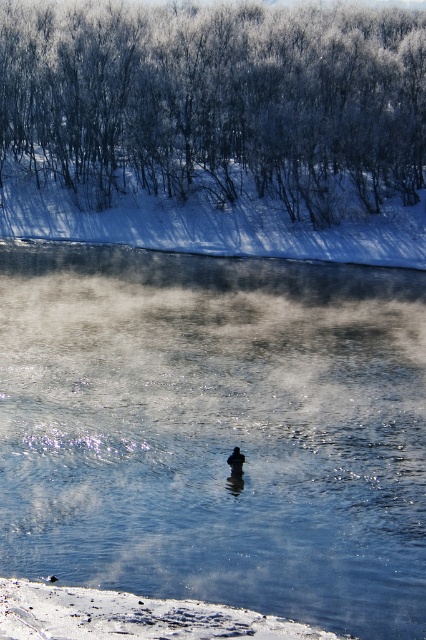
Is clear ice water at center in front of snowy branches at upper center?

Yes, clear ice water at center is closer to the viewer.

Who is higher up, clear ice water at center or snowy branches at upper center?

snowy branches at upper center is higher up.

The image size is (426, 640). What do you see at coordinates (216, 429) in the screenshot? I see `clear ice water at center` at bounding box center [216, 429].

This screenshot has width=426, height=640. In order to click on clear ice water at center in this screenshot , I will do `click(216, 429)`.

Which of these two, snowy branches at upper center or dark brown duck at center, stands shorter?

Standing shorter between the two is dark brown duck at center.

Does snowy branches at upper center have a greater width compared to dark brown duck at center?

Yes.

Does point (173, 44) lie in front of point (235, 454)?

No.

Where is `snowy branches at upper center`? This screenshot has width=426, height=640. snowy branches at upper center is located at coordinates (215, 100).

From the picture: Is the position of clear ice water at center less distant than that of dark brown duck at center?

Yes, clear ice water at center is closer to the viewer.

Which is in front, point (403, 417) or point (227, 458)?

Point (227, 458)

Is point (383, 544) behind point (241, 454)?

No, it is in front of (241, 454).

At what (x,y) coordinates should I click in order to perform the action: click on clear ice water at center. Please return your answer as a coordinate pair (x, y). This screenshot has width=426, height=640. Looking at the image, I should click on (216, 429).